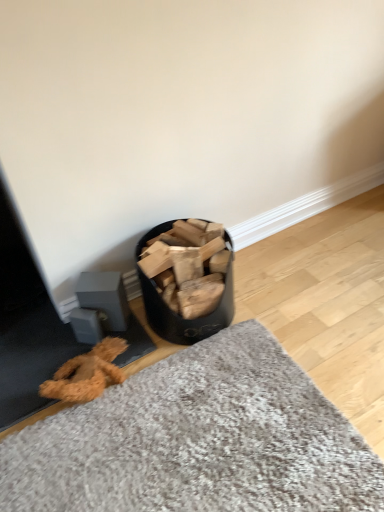
Identify the location of free space on the front side of black matte wood at center. The width and height of the screenshot is (384, 512). (202, 385).